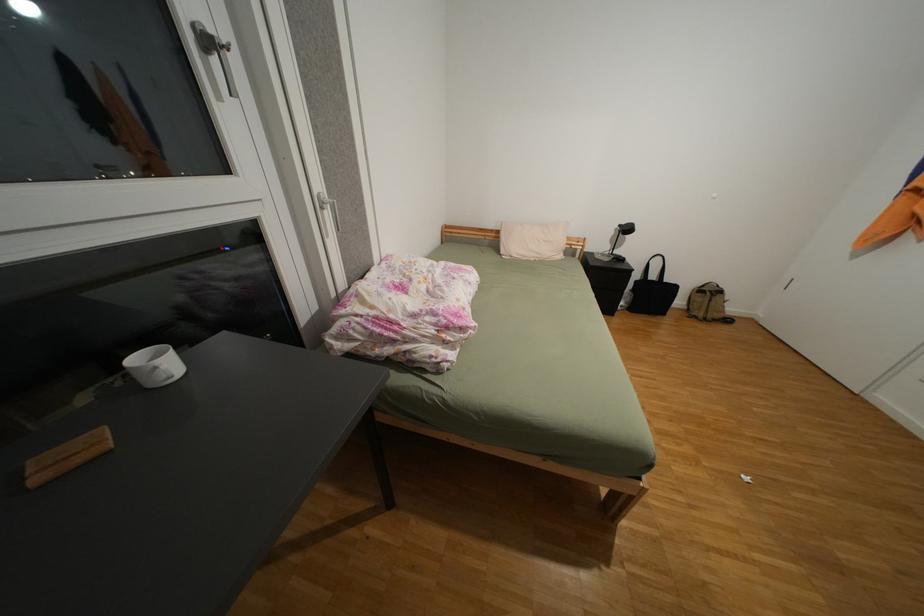
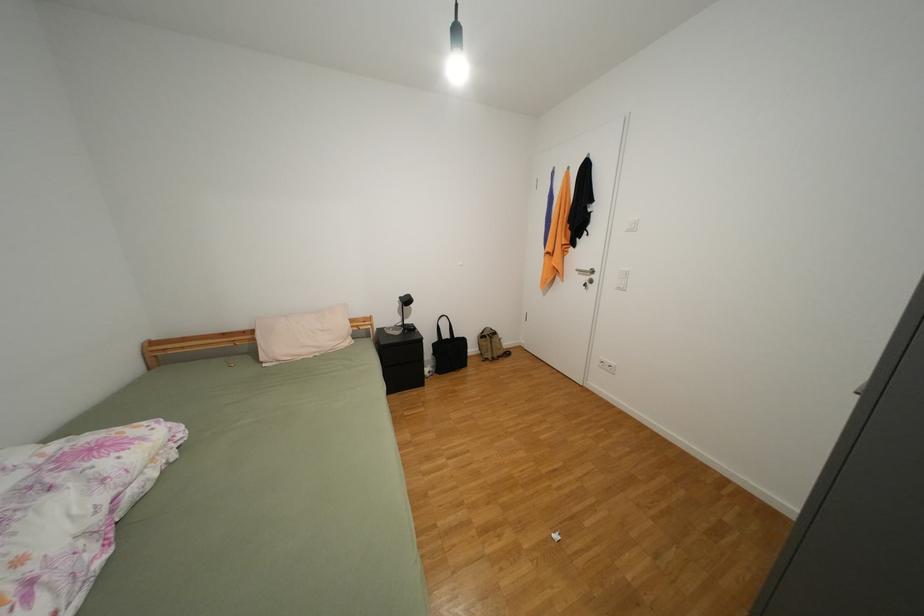
Question: The camera is either moving clockwise (left) or counter-clockwise (right) around the object. The first image is from the beginning of the video and the second image is from the end. Is the camera moving left or right when shooting the video?

Choices:
 (A) Left
 (B) Right

Answer: (A)